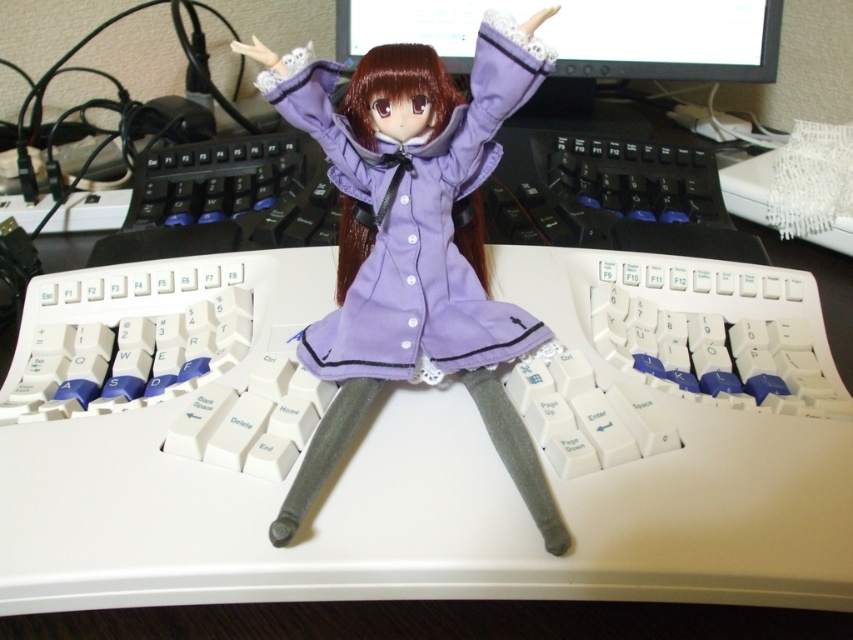
You are setting up a display on your desk and want to place the purple fabric doll at center and the matte black monitor at upper center. Given that the desk space is narrow, which object will require more horizontal space?

The purple fabric doll at center is thinner than the matte black monitor at upper center, so the matte black monitor at upper center will require more horizontal space.

You are setting up a new monitor and want to place the purple fabric doll at center so it faces the matte black monitor at upper center. Is the doll currently positioned in the correct spot to face the monitor?

The purple fabric doll at center is positioned on the left side of the matte black monitor at upper center, so it is facing the monitor correctly.

You are a robot trying to place a small object on the keyboard. You need to choose between placing it at point (494, 88) or point (579, 58). Which point is closer to the front of the keyboard?

Point (494, 88) is in front of point (579, 58), so placing the object there would be closer to the front of the keyboard.